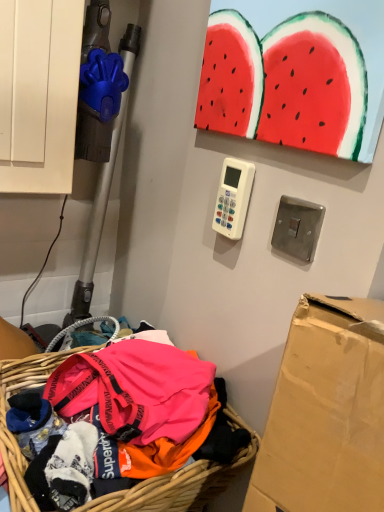
Question: Does brushed metal light switch at upper right have a lesser height compared to bright pink fabric at lower left?

Choices:
 (A) no
 (B) yes

Answer: (B)

Question: Is brushed metal light switch at upper right thinner than bright pink fabric at lower left?

Choices:
 (A) yes
 (B) no

Answer: (A)

Question: Is brushed metal light switch at upper right taller than bright pink fabric at lower left?

Choices:
 (A) yes
 (B) no

Answer: (B)

Question: Does brushed metal light switch at upper right appear on the right side of bright pink fabric at lower left?

Choices:
 (A) no
 (B) yes

Answer: (B)

Question: Is brushed metal light switch at upper right to the left of bright pink fabric at lower left from the viewer's perspective?

Choices:
 (A) no
 (B) yes

Answer: (A)

Question: Is brushed metal light switch at upper right behind bright pink fabric at lower left?

Choices:
 (A) yes
 (B) no

Answer: (A)

Question: Would you consider bright pink fabric at lower left to be distant from white plastic remote control at center?

Choices:
 (A) yes
 (B) no

Answer: (B)

Question: Is bright pink fabric at lower left placed right next to white plastic remote control at center?

Choices:
 (A) no
 (B) yes

Answer: (A)

Question: From the image's perspective, is bright pink fabric at lower left below white plastic remote control at center?

Choices:
 (A) no
 (B) yes

Answer: (B)

Question: Is bright pink fabric at lower left thinner than white plastic remote control at center?

Choices:
 (A) yes
 (B) no

Answer: (B)

Question: Is bright pink fabric at lower left facing away from white plastic remote control at center?

Choices:
 (A) no
 (B) yes

Answer: (A)

Question: From the image's perspective, is bright pink fabric at lower left over white plastic remote control at center?

Choices:
 (A) yes
 (B) no

Answer: (B)

Question: Is bright pink fabric at lower left turned away from brushed metal light switch at upper right?

Choices:
 (A) no
 (B) yes

Answer: (A)